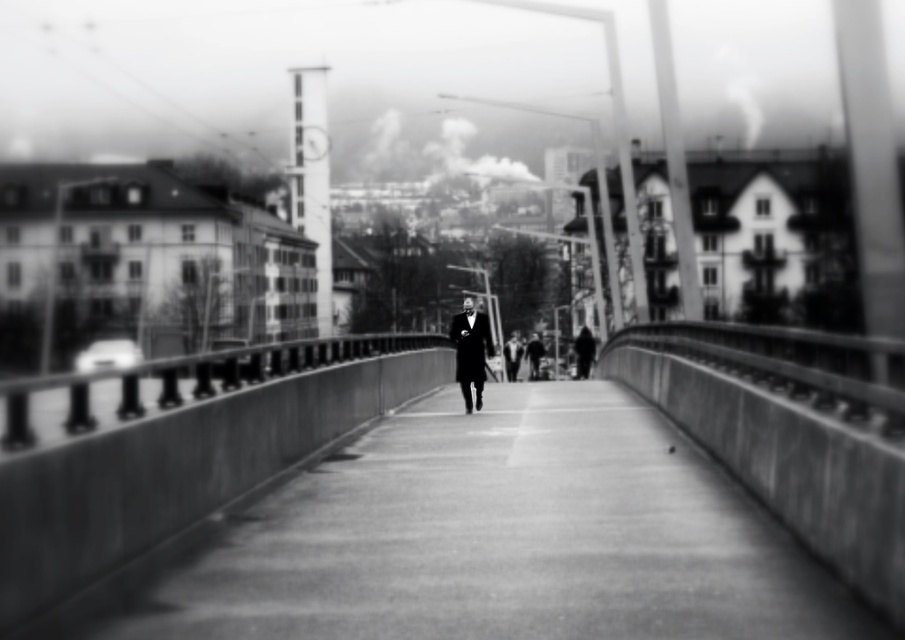
Does smooth concrete path at center have a greater height compared to black wool coat at center?

Incorrect, smooth concrete path at center's height is not larger of black wool coat at center's.

Is smooth concrete path at center behind black wool coat at center?

No.

Describe the element at coordinates (505, 538) in the screenshot. I see `smooth concrete path at center` at that location.

I want to click on smooth concrete path at center, so click(505, 538).